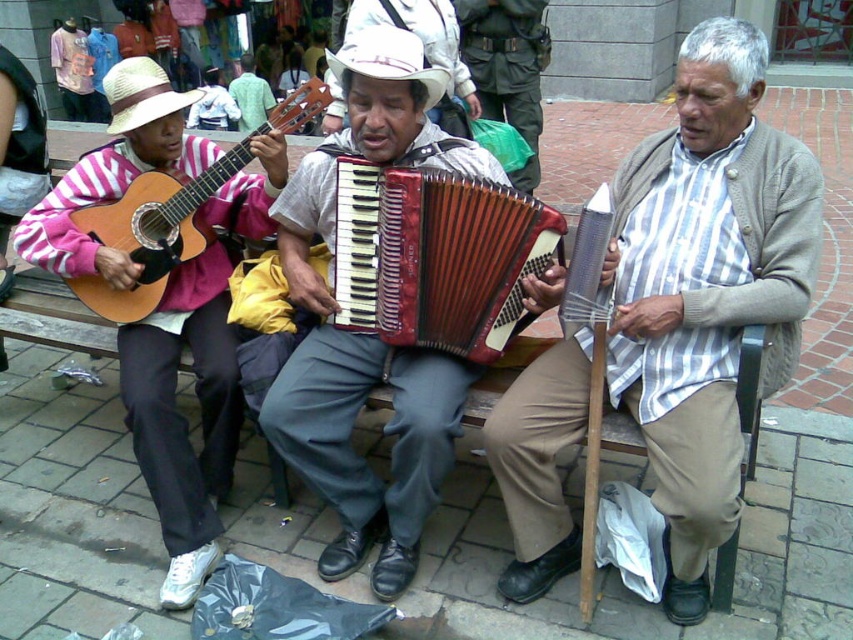
You are a street performer with a 24 inch wide drum. You want to place it between the red leather accordion at center and the matte wood guitar at left. Can you fit it there?

The distance between the red leather accordion at center and the matte wood guitar at left is 23.79 inches. Since the drum is 24 inches wide, it cannot fit in the space between them.

You are a photographer standing at the camera position. You want to take a closeup photo of the striped cotton shirt at center. Can you reach it with your camera without moving your position?

The striped cotton shirt at center is 1.82 meters from camera, so yes, you can reach it with your camera without moving your position since it is within a typical camera focus range.